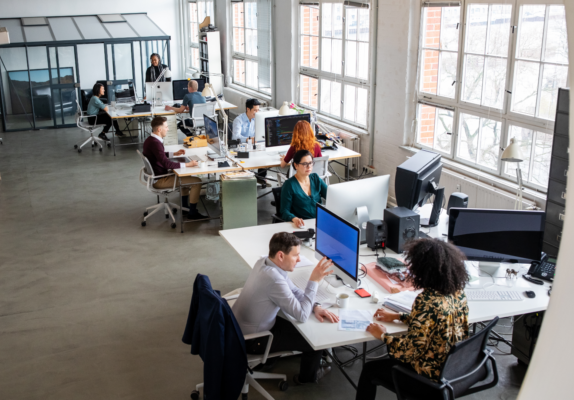
I want to click on computer screens, so click(x=336, y=234), click(x=273, y=126), click(x=406, y=179), click(x=354, y=197), click(x=211, y=130), click(x=159, y=87), click(x=123, y=91), click(x=183, y=87).